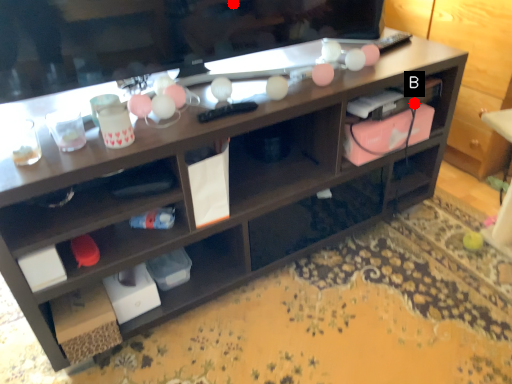
Question: Two points are circled on the image, labeled by A and B beside each circle. Which of the following is the farthest from the observer?

Choices:
 (A) A is further
 (B) B is further

Answer: (B)